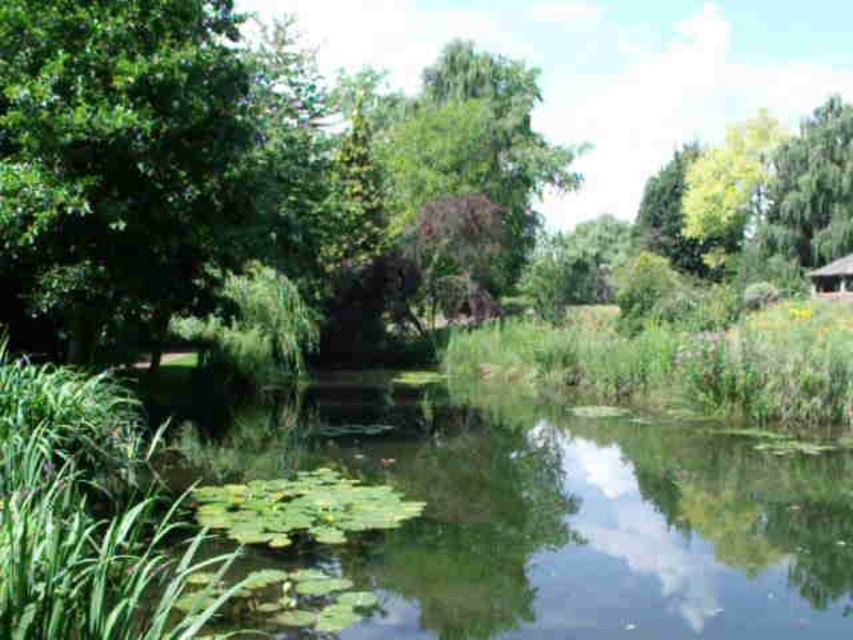
Question: Is green leafy tree at center bigger than wooden hut at right?

Choices:
 (A) yes
 (B) no

Answer: (A)

Question: Which of the following is the closest to the observer?

Choices:
 (A) (53, 268)
 (B) (833, 260)

Answer: (A)

Question: Is green leafy tree at center in front of green leafy tree at upper right?

Choices:
 (A) yes
 (B) no

Answer: (A)

Question: Which of the following is the farthest from the observer?

Choices:
 (A) (815, 294)
 (B) (166, 232)
 (C) (820, 200)

Answer: (C)

Question: Is green leafy tree at upper right above wooden hut at right?

Choices:
 (A) yes
 (B) no

Answer: (A)

Question: Which object is the closest to the green leafy tree at center?

Choices:
 (A) wooden hut at right
 (B) green leafy tree at upper right

Answer: (B)